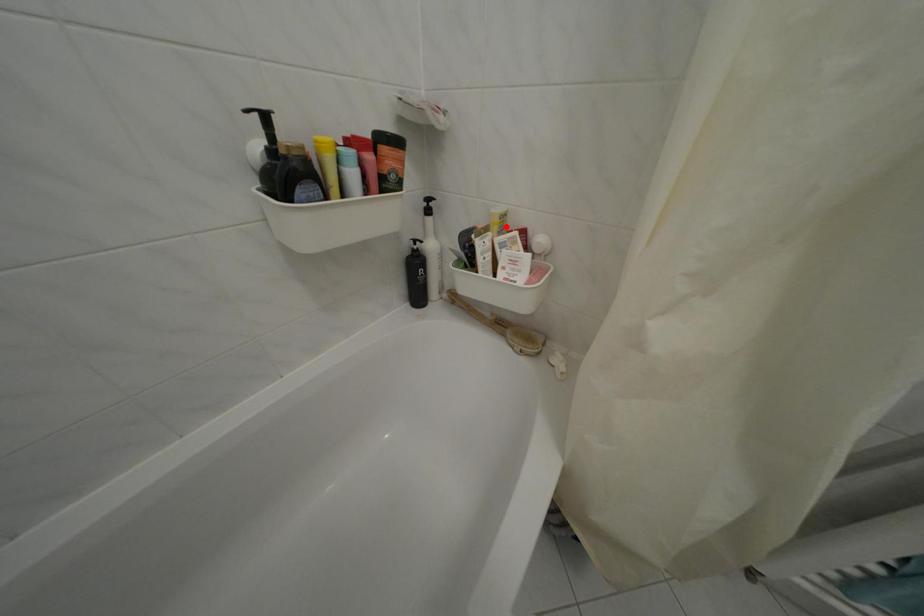
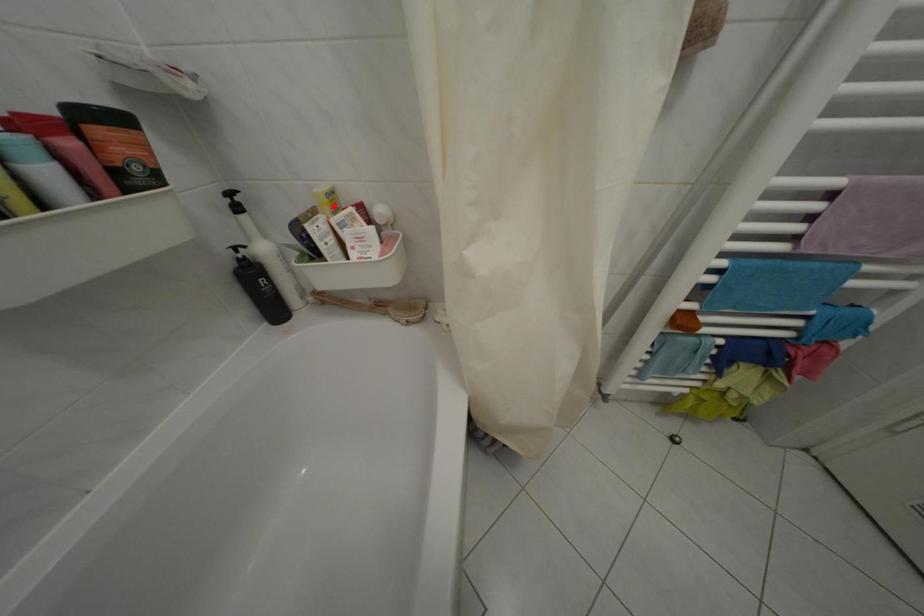
I am providing you with two images of the same scene from different viewpoints. A red point is marked on the first image and another point is marked on the second image. Is the marked point in image1 the same physical position as the marked point in image2?

Yes